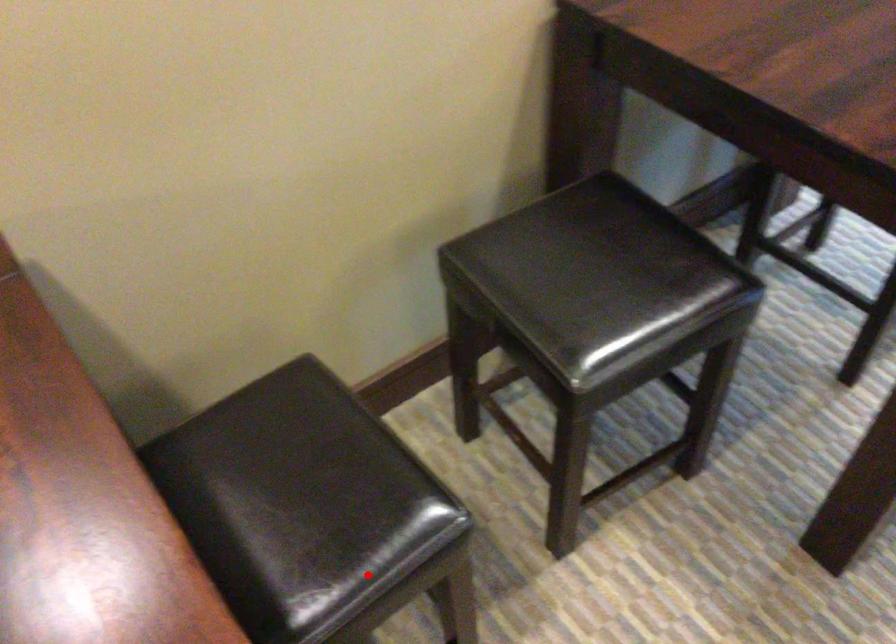
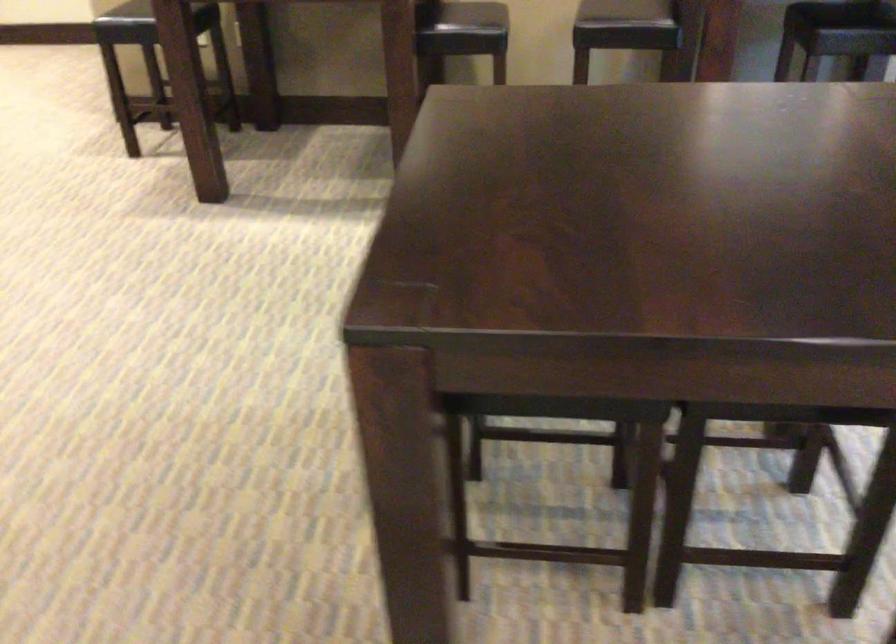
Question: A red point is marked in image1. In image2, is the corresponding 3D point closer to the camera or farther? Reply with the corresponding letter.

Choices:
 (A) The corresponding 3D point is closer.
 (B) The corresponding 3D point is farther.

Answer: (B)